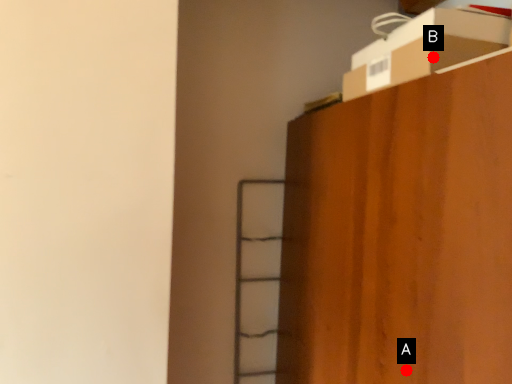
Question: Two points are circled on the image, labeled by A and B beside each circle. Which point is closer to the camera taking this photo?

Choices:
 (A) A is closer
 (B) B is closer

Answer: (A)